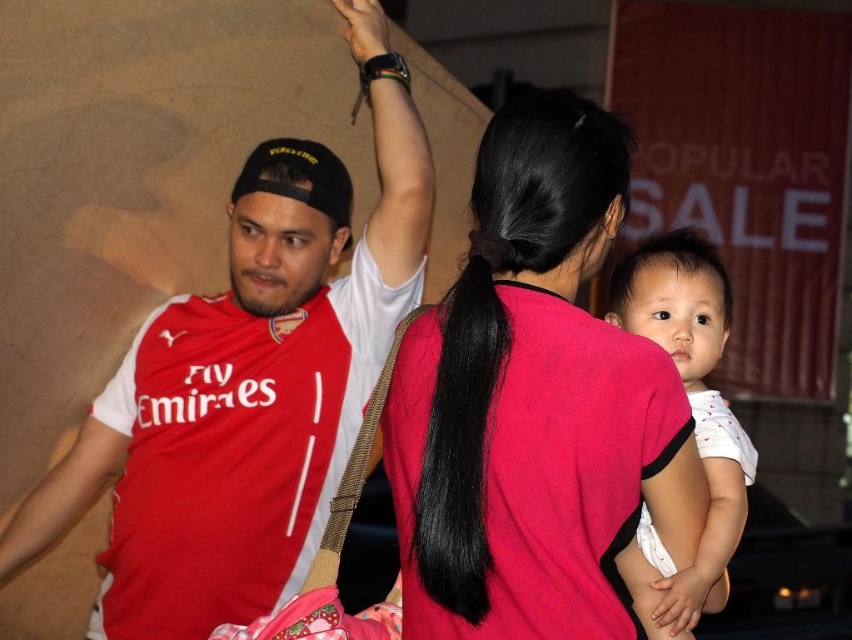
You are a photographer trying to capture a clear shot of both the matte jersey at center and the black leather watch at upper center. Given their sizes, which object should you focus on first to ensure it fits within your camera frame?

The matte jersey at center is much taller than the black leather watch at upper center, so you should focus on capturing the matte jersey at center first to ensure it fits within the frame, as it is larger in size.

You are a photographer trying to capture a clear shot of both the matte jersey at center and the black silky hair at center. Since you want to ensure both are in focus, which object should you prioritize focusing on first based on their size in the frame?

The matte jersey at center should be prioritized for focusing first because it is wider than the black silky hair at center, making it a larger subject in the frame.